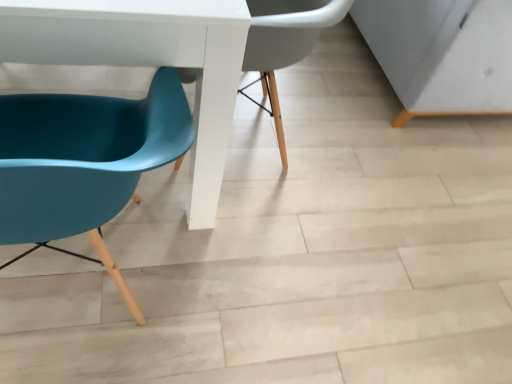
Where is `teal plastic chair at left, the second chair from the top`? teal plastic chair at left, the second chair from the top is located at coordinates (84, 162).

The height and width of the screenshot is (384, 512). I want to click on teal plastic chair at left, the second chair from the top, so click(84, 162).

How distant is teal plastic chair at left, the second chair from the top, from white glossy table at lower left?

→ teal plastic chair at left, the second chair from the top, is 19.85 centimeters from white glossy table at lower left.

Is teal plastic chair at left, the second chair from the top, inside or outside of white glossy table at lower left?

teal plastic chair at left, the second chair from the top, is located beyond the bounds of white glossy table at lower left.

From the image's perspective, is teal plastic chair at left, arranged as the 1th chair when ordered from the bottom, located above or below white glossy table at lower left?

From the image's perspective, teal plastic chair at left, arranged as the 1th chair when ordered from the bottom, appears below white glossy table at lower left.

Where is `chair in front of the white glossy table at lower left`? This screenshot has height=384, width=512. chair in front of the white glossy table at lower left is located at coordinates (84, 162).

This screenshot has height=384, width=512. In order to click on chair above the teal plastic chair at left, the second chair from the top (from the image's perspective) in this screenshot , I will do 284,43.

Between point (293, 5) and point (48, 183), which one is positioned in front?

The point (48, 183) is closer to the camera.

Can you confirm if teal plastic chair at left, the 1th chair viewed from the top, is wider than teal plastic chair at left, the second chair from the top?

Correct, the width of teal plastic chair at left, the 1th chair viewed from the top, exceeds that of teal plastic chair at left, the second chair from the top.

Visually, is teal plastic chair at left, the second chair when ordered from bottom to top, positioned to the left or to the right of teal plastic chair at left, the second chair from the top?

Based on their positions, teal plastic chair at left, the second chair when ordered from bottom to top, is located to the right of teal plastic chair at left, the second chair from the top.

How many degrees apart are the facing directions of teal plastic chair at left, the second chair when ordered from bottom to top, and white glossy table at lower left?

teal plastic chair at left, the second chair when ordered from bottom to top, and white glossy table at lower left are facing 178 degrees away from each other.

Based on the photo, is white glossy table at lower left located within teal plastic chair at left, the 1th chair viewed from the top?

No, teal plastic chair at left, the 1th chair viewed from the top, does not contain white glossy table at lower left.

Considering the relative positions of teal plastic chair at left, the 1th chair viewed from the top, and white glossy table at lower left in the image provided, is teal plastic chair at left, the 1th chair viewed from the top, in front of white glossy table at lower left?

No, the depth of teal plastic chair at left, the 1th chair viewed from the top, is greater than that of white glossy table at lower left.

Is point (270, 69) positioned before point (173, 20)?

No, (270, 69) is behind (173, 20).

From a real-world perspective, who is located lower, teal plastic chair at left, arranged as the 1th chair when ordered from the bottom, or teal plastic chair at left, the 1th chair viewed from the top?

teal plastic chair at left, the 1th chair viewed from the top.

Is teal plastic chair at left, the second chair from the top, not close to teal plastic chair at left, the 1th chair viewed from the top?

No.

Considering the sizes of teal plastic chair at left, the second chair from the top, and teal plastic chair at left, the 1th chair viewed from the top, in the image, is teal plastic chair at left, the second chair from the top, taller or shorter than teal plastic chair at left, the 1th chair viewed from the top,?

Considering their sizes, teal plastic chair at left, the second chair from the top, has more height than teal plastic chair at left, the 1th chair viewed from the top.

Does point (55, 14) appear closer or farther from the camera than point (166, 154)?

Point (55, 14) is positioned farther from the camera compared to point (166, 154).

Visually, is white glossy table at lower left positioned to the left or to the right of teal plastic chair at left, arranged as the 1th chair when ordered from the bottom?

white glossy table at lower left is positioned on teal plastic chair at left, arranged as the 1th chair when ordered from the bottom,'s left side.

From a real-world perspective, is white glossy table at lower left over teal plastic chair at left, the second chair from the top?

No, from a real-world perspective, white glossy table at lower left is not above teal plastic chair at left, the second chair from the top.

How many degrees apart are the facing directions of white glossy table at lower left and teal plastic chair at left, the 1th chair viewed from the top?

178 degrees.

Is white glossy table at lower left inside or outside of teal plastic chair at left, the second chair when ordered from bottom to top?

white glossy table at lower left lies outside teal plastic chair at left, the second chair when ordered from bottom to top.

Consider the image. From a real-world perspective, is white glossy table at lower left below teal plastic chair at left, the second chair when ordered from bottom to top?

No, from a real-world perspective, white glossy table at lower left is not under teal plastic chair at left, the second chair when ordered from bottom to top.

Can you confirm if white glossy table at lower left is positioned to the right of teal plastic chair at left, the second chair when ordered from bottom to top?

No, white glossy table at lower left is not to the right of teal plastic chair at left, the second chair when ordered from bottom to top.

Identify the location of table that appears above the teal plastic chair at left, arranged as the 1th chair when ordered from the bottom (from the image's perspective). The height and width of the screenshot is (384, 512). (147, 61).

What are the coordinates of `chair below the teal plastic chair at left, the second chair when ordered from bottom to top (from the image's perspective)` in the screenshot? It's located at (84, 162).

Considering their positions, is teal plastic chair at left, the 1th chair viewed from the top, positioned closer to teal plastic chair at left, the second chair from the top, than white glossy table at lower left?

white glossy table at lower left is closer to teal plastic chair at left, the second chair from the top.

Looking at this image, estimate the real-world distances between objects in this image. Which object is closer to white glossy table at lower left, teal plastic chair at left, the second chair from the top, or teal plastic chair at left, the second chair when ordered from bottom to top?

teal plastic chair at left, the second chair from the top.

Consider the image. Considering their positions, is teal plastic chair at left, arranged as the 1th chair when ordered from the bottom, positioned closer to teal plastic chair at left, the second chair when ordered from bottom to top, than white glossy table at lower left?

white glossy table at lower left.

Estimate the real-world distances between objects in this image. Which object is further from white glossy table at lower left, teal plastic chair at left, the 1th chair viewed from the top, or teal plastic chair at left, arranged as the 1th chair when ordered from the bottom?

teal plastic chair at left, the 1th chair viewed from the top, lies further to white glossy table at lower left than the other object.

Looking at the image, which one is located further to teal plastic chair at left, the second chair from the top, white glossy table at lower left or teal plastic chair at left, the second chair when ordered from bottom to top?

teal plastic chair at left, the second chair when ordered from bottom to top, lies further to teal plastic chair at left, the second chair from the top, than the other object.

When comparing their distances from teal plastic chair at left, the 1th chair viewed from the top, does white glossy table at lower left or teal plastic chair at left, the second chair from the top, seem closer?

Among the two, white glossy table at lower left is located nearer to teal plastic chair at left, the 1th chair viewed from the top.

Where is `chair between white glossy table at lower left and teal plastic chair at left, the second chair from the top, from top to bottom`? chair between white glossy table at lower left and teal plastic chair at left, the second chair from the top, from top to bottom is located at coordinates (284, 43).